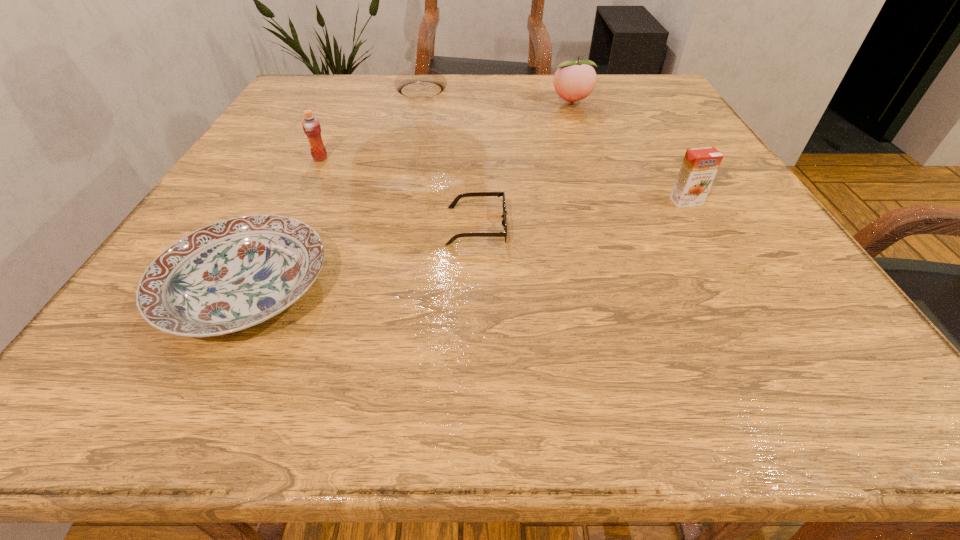
Where is `object that is at the near left corner`? The width and height of the screenshot is (960, 540). object that is at the near left corner is located at coordinates (233, 274).

The width and height of the screenshot is (960, 540). What are the coordinates of `free region at the far edge` in the screenshot? It's located at (593, 92).

Image resolution: width=960 pixels, height=540 pixels. Find the location of `vacant space at the near edge of the desktop`. vacant space at the near edge of the desktop is located at coordinates (577, 345).

In the image, there is a desktop. Identify the location of free space at the left edge. The image size is (960, 540). (254, 194).

Locate an element on the screen. vacant space at the right edge of the desktop is located at coordinates (718, 205).

I want to click on vacant area at the far left corner, so click(x=311, y=80).

In the image, there is a desktop. Identify the location of free space at the far right corner. This screenshot has height=540, width=960. (654, 82).

Image resolution: width=960 pixels, height=540 pixels. Identify the location of vacant space at the near right corner of the desktop. (803, 357).

At what (x,y) coordinates should I click in order to perform the action: click on free space between the peach and the sunglasses. Please return your answer as a coordinate pair (x, y). The height and width of the screenshot is (540, 960). Looking at the image, I should click on (524, 165).

You are a GUI agent. You are given a task and a screenshot of the screen. Output one action in this format:
    pyautogui.click(x=<x>, y=<y>)
    Task: Click on the vacant point located between the plate and the tallest object
    The height and width of the screenshot is (540, 960).
    Given the screenshot: What is the action you would take?
    pyautogui.click(x=333, y=189)